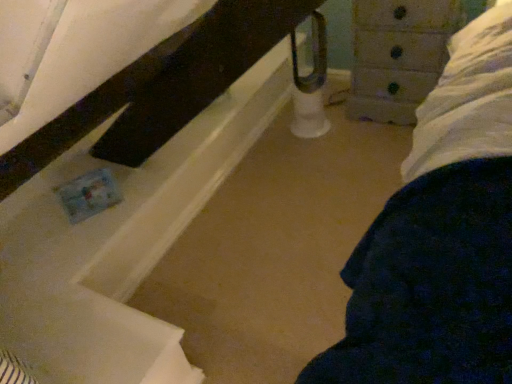
The height and width of the screenshot is (384, 512). Find the location of `vacant area situated to the left side of wooden chest of drawers at upper right`. vacant area situated to the left side of wooden chest of drawers at upper right is located at coordinates (337, 134).